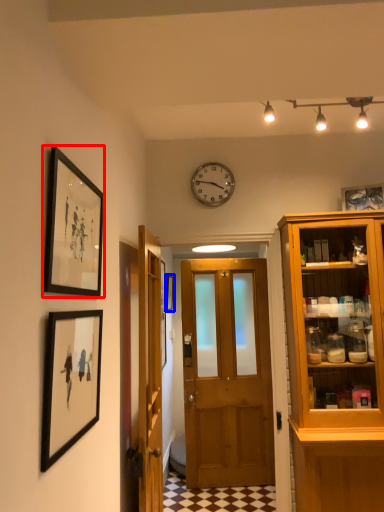
Question: Among these objects, which one is farthest to the camera, picture frame (highlighted by a red box) or picture frame (highlighted by a blue box)?

Choices:
 (A) picture frame
 (B) picture frame

Answer: (B)